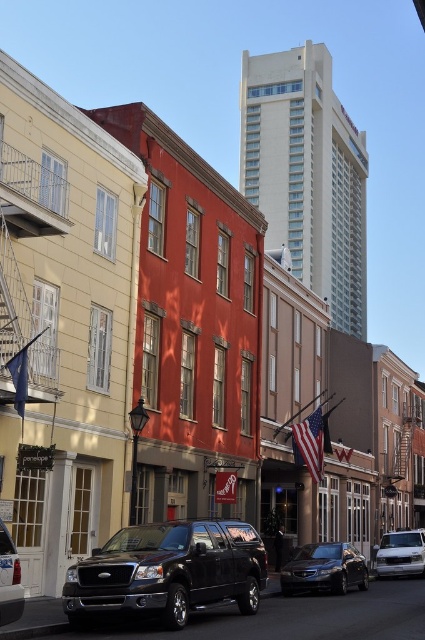
Which is in front, point (424, 540) or point (300, 428)?

Point (424, 540) is in front.

Measure the distance between silver metallic van at lower right and camera.

silver metallic van at lower right is 44.04 meters from camera.

Which is in front, point (380, 572) or point (308, 424)?

Positioned in front is point (380, 572).

At what (x,y) coordinates should I click in order to perform the action: click on silver metallic van at lower right. Please return your answer as a coordinate pair (x, y). The width and height of the screenshot is (425, 640). Looking at the image, I should click on (401, 554).

Can you confirm if american flag at center is positioned to the right of blue fabric flag at lower left?

Yes, american flag at center is to the right of blue fabric flag at lower left.

Find the location of a particular element. Image resolution: width=425 pixels, height=640 pixels. american flag at center is located at coordinates (309, 444).

Which is more to the left, shiny black sedan at center or blue fabric flag at lower left?

From the viewer's perspective, blue fabric flag at lower left appears more on the left side.

Is point (303, 573) closer to viewer compared to point (14, 387)?

That is False.

Who is more forward, (311, 576) or (20, 369)?

Point (20, 369) is in front.

At what (x,y) coordinates should I click in order to perform the action: click on shiny black sedan at center. Please return your answer as a coordinate pair (x, y). Looking at the image, I should click on (325, 570).